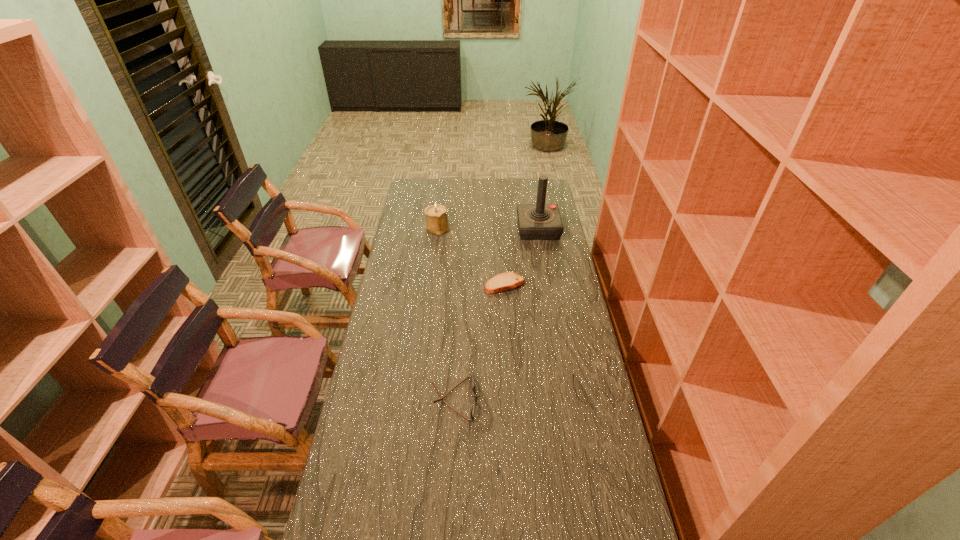
Identify the location of the tallest object. The width and height of the screenshot is (960, 540). click(x=540, y=221).

Identify the location of the third shortest object. (436, 215).

Locate an element on the screen. the second shortest object is located at coordinates (472, 410).

Locate an element on the screen. the nearest object is located at coordinates (472, 410).

The image size is (960, 540). I want to click on the shortest object, so click(x=505, y=281).

Where is `the third farthest object`? The image size is (960, 540). the third farthest object is located at coordinates (505, 281).

I want to click on free location located 0.360m on the rectangular base of the tallest object, so click(443, 228).

Find the location of a particular element. This screenshot has height=540, width=960. vacant space positioned on the rectangular base of the tallest object is located at coordinates (441, 228).

This screenshot has width=960, height=540. I want to click on vacant space located 0.240m on the rectangular base of the tallest object, so click(468, 228).

I want to click on vacant space located on the left of the second tallest object, so click(415, 228).